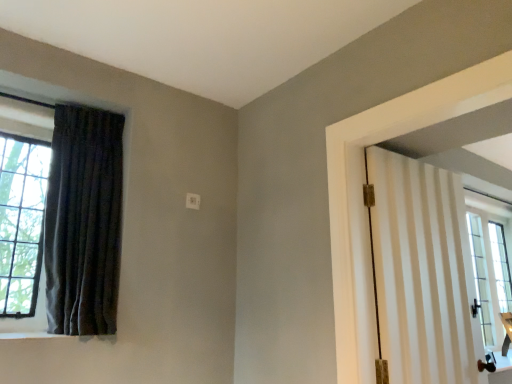
Question: In the image, is dark velvet curtain at left positioned in front of or behind white striped door at right?

Choices:
 (A) front
 (B) behind

Answer: (B)

Question: Is point (92, 299) positioned closer to the camera than point (371, 150)?

Choices:
 (A) closer
 (B) farther

Answer: (A)

Question: Is dark velvet curtain at left inside the boundaries of white striped door at right, or outside?

Choices:
 (A) outside
 (B) inside

Answer: (A)

Question: Does point (409, 327) appear closer or farther from the camera than point (45, 221)?

Choices:
 (A) farther
 (B) closer

Answer: (B)

Question: From their relative heights in the image, would you say white striped door at right is taller or shorter than dark velvet curtain at left?

Choices:
 (A) short
 (B) tall

Answer: (A)

Question: Considering the positions of white striped door at right and dark velvet curtain at left in the image, is white striped door at right bigger or smaller than dark velvet curtain at left?

Choices:
 (A) small
 (B) big

Answer: (A)

Question: From the image's perspective, is white striped door at right positioned above or below dark velvet curtain at left?

Choices:
 (A) below
 (B) above

Answer: (A)